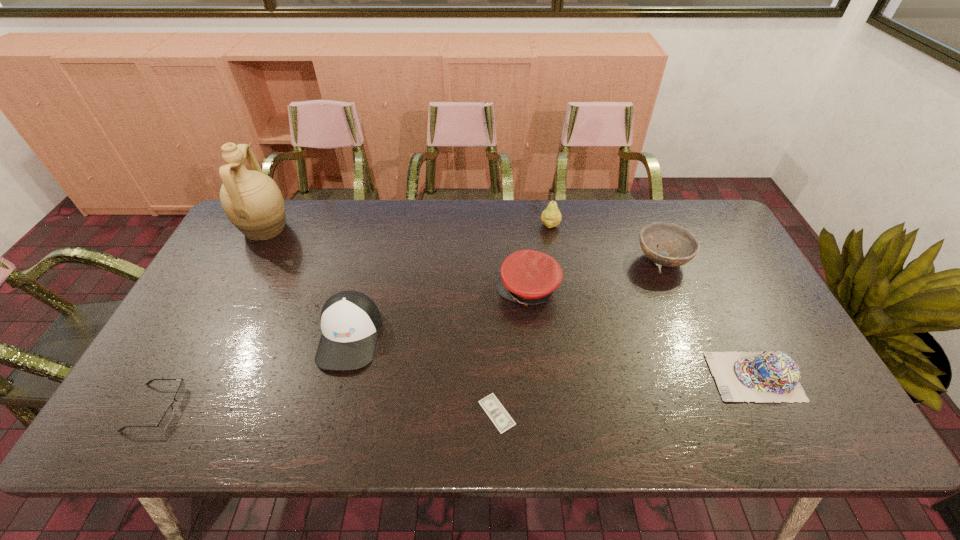
Where is `pitcher`? The image size is (960, 540). pitcher is located at coordinates (252, 201).

What are the coordinates of `pear` in the screenshot? It's located at (551, 217).

Identify the location of the third object from left to right. (350, 321).

The image size is (960, 540). In order to click on the leftmost cap in this screenshot , I will do `click(350, 321)`.

This screenshot has width=960, height=540. I want to click on the second cap from left to right, so click(528, 277).

Locate an element on the screen. bowl is located at coordinates (683, 247).

The width and height of the screenshot is (960, 540). In order to click on the sixth tallest object in this screenshot , I will do `click(768, 376)`.

This screenshot has height=540, width=960. Find the location of `the rightmost cap`. the rightmost cap is located at coordinates 768,376.

Locate an element on the screen. The height and width of the screenshot is (540, 960). the second shortest object is located at coordinates (168, 415).

This screenshot has width=960, height=540. In order to click on money in this screenshot , I will do `click(499, 416)`.